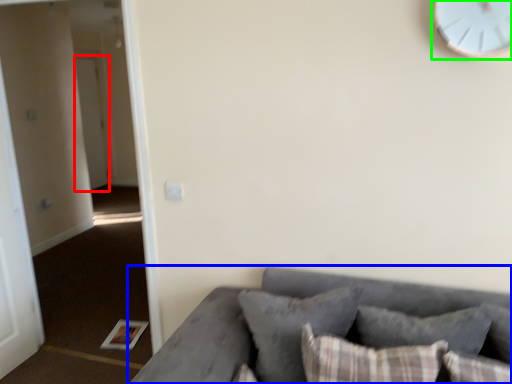
Question: Which object is the closest to the door (highlighted by a red box)? Choose among these: studio couch (highlighted by a blue box) or clock (highlighted by a green box).

Choices:
 (A) studio couch
 (B) clock

Answer: (A)